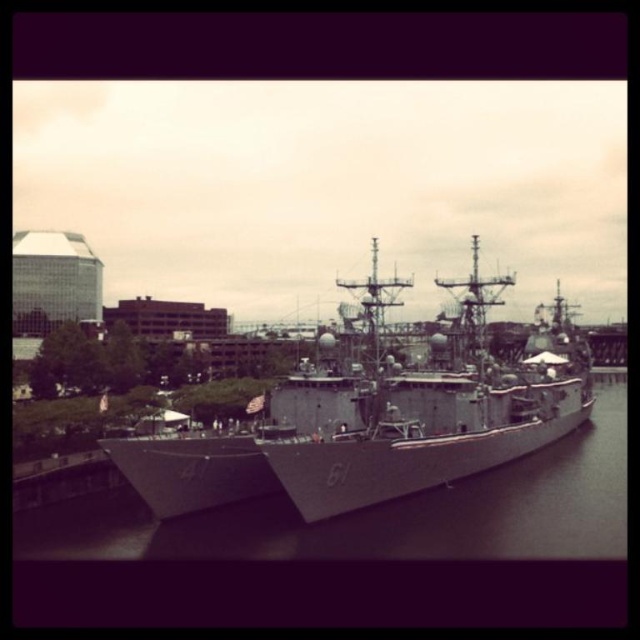
Question: Is gray metallic ship at center closer to camera compared to gray metallic water at center?

Choices:
 (A) no
 (B) yes

Answer: (A)

Question: Where is gray metallic ship at center located in relation to gray metallic water at center in the image?

Choices:
 (A) below
 (B) above

Answer: (B)

Question: Which point is farther to the camera?

Choices:
 (A) (572, 452)
 (B) (460, 337)

Answer: (A)

Question: Which point appears closest to the camera in this image?

Choices:
 (A) (60, 518)
 (B) (458, 472)

Answer: (A)

Question: Is gray metallic ship at center behind gray metallic water at center?

Choices:
 (A) no
 (B) yes

Answer: (B)